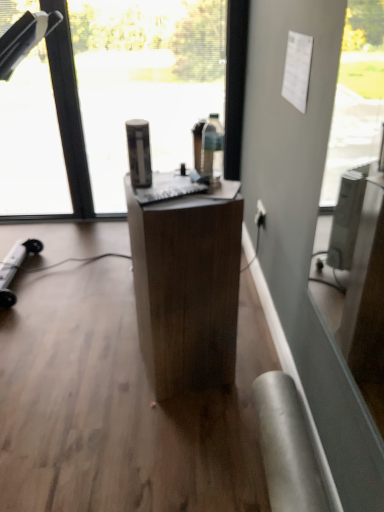
Question: Should I look upward or downward to see wooden desk at center?

Choices:
 (A) up
 (B) down

Answer: (B)

Question: Is transparent glass window at center taller than white plastic power outlet at lower right?

Choices:
 (A) no
 (B) yes

Answer: (B)

Question: From the image's perspective, does transparent glass window at center appear higher than white plastic power outlet at lower right?

Choices:
 (A) yes
 (B) no

Answer: (A)

Question: Can you confirm if transparent glass window at center is wider than white plastic power outlet at lower right?

Choices:
 (A) no
 (B) yes

Answer: (B)

Question: From a real-world perspective, is transparent glass window at center over white plastic power outlet at lower right?

Choices:
 (A) yes
 (B) no

Answer: (A)

Question: Considering the relative sizes of transparent glass window at center and white plastic power outlet at lower right in the image provided, is transparent glass window at center smaller than white plastic power outlet at lower right?

Choices:
 (A) no
 (B) yes

Answer: (A)

Question: Is transparent glass window at center at the right side of white plastic power outlet at lower right?

Choices:
 (A) no
 (B) yes

Answer: (A)

Question: Are white plastic power outlet at lower right and wooden desk at center far apart?

Choices:
 (A) yes
 (B) no

Answer: (B)

Question: Does white plastic power outlet at lower right come behind wooden desk at center?

Choices:
 (A) yes
 (B) no

Answer: (A)

Question: Is white plastic power outlet at lower right positioned beyond the bounds of wooden desk at center?

Choices:
 (A) yes
 (B) no

Answer: (A)

Question: Considering the relative sizes of white plastic power outlet at lower right and wooden desk at center in the image provided, is white plastic power outlet at lower right bigger than wooden desk at center?

Choices:
 (A) yes
 (B) no

Answer: (B)

Question: From a real-world perspective, does white plastic power outlet at lower right sit lower than wooden desk at center?

Choices:
 (A) no
 (B) yes

Answer: (B)

Question: Is white plastic power outlet at lower right facing away from wooden desk at center?

Choices:
 (A) yes
 (B) no

Answer: (B)

Question: Considering the relative sizes of white plastic power outlet at lower right and transparent glass window at center in the image provided, is white plastic power outlet at lower right wider than transparent glass window at center?

Choices:
 (A) no
 (B) yes

Answer: (A)